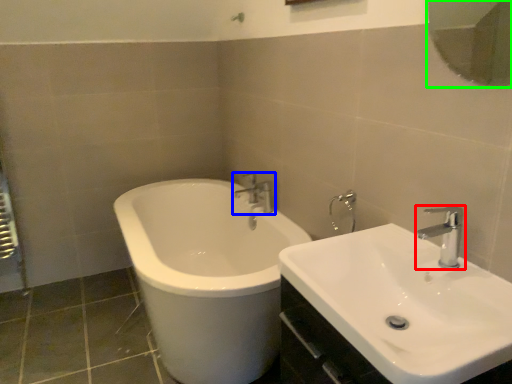
Question: Based on their relative distances, which object is nearer to tap (highlighted by a red box)? Choose from tap (highlighted by a blue box) and mirror (highlighted by a green box).

Choices:
 (A) tap
 (B) mirror

Answer: (A)